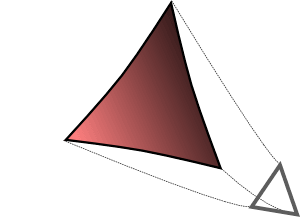
The image size is (300, 217). Identify the location of wall. (78, 27).